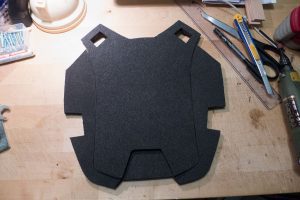
Where is `screws`? This screenshot has width=300, height=200. screws is located at coordinates (7, 40).